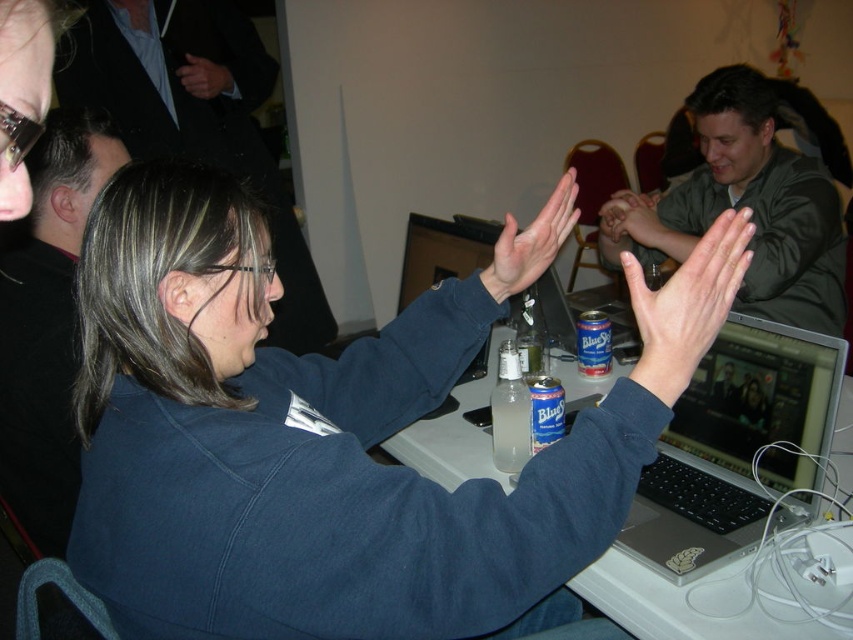
Question: Which point appears closest to the camera in this image?

Choices:
 (A) (631, 220)
 (B) (695, 269)

Answer: (B)

Question: Which object appears farthest from the camera in this image?

Choices:
 (A) matte blue sweater at center
 (B) black matte jacket at upper left

Answer: (B)

Question: Among these points, which one is farthest from the camera?

Choices:
 (A) (724, 317)
 (B) (645, 224)
 (C) (439, 460)
 (D) (524, 310)

Answer: (D)

Question: Does dark blue jacket at upper left appear under matte skin hand at center?

Choices:
 (A) no
 (B) yes

Answer: (A)

Question: Can you confirm if black matte jacket at upper left is bigger than white matte hand at upper center?

Choices:
 (A) no
 (B) yes

Answer: (B)

Question: Does smooth skin hand at center have a smaller size compared to clear glass bottle at center?

Choices:
 (A) yes
 (B) no

Answer: (B)